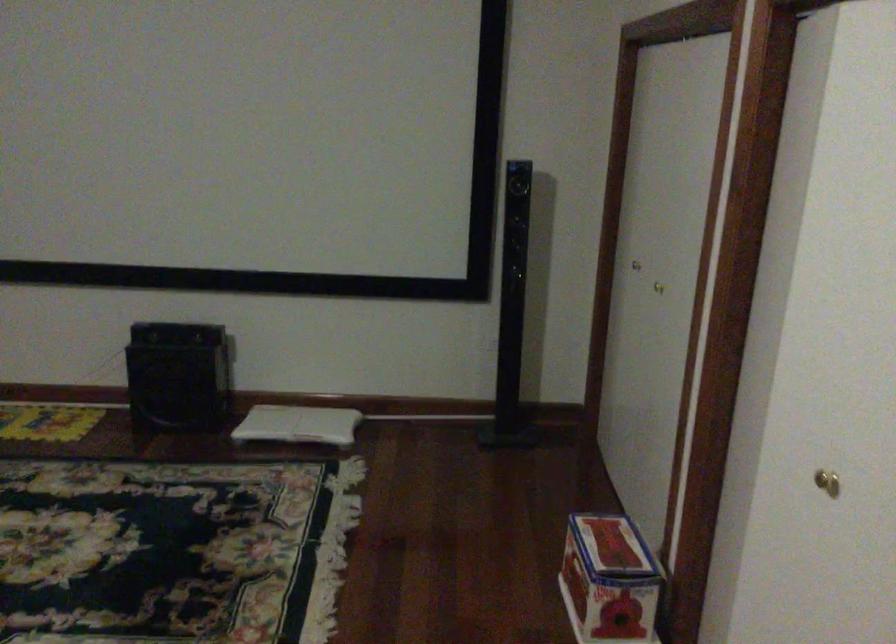
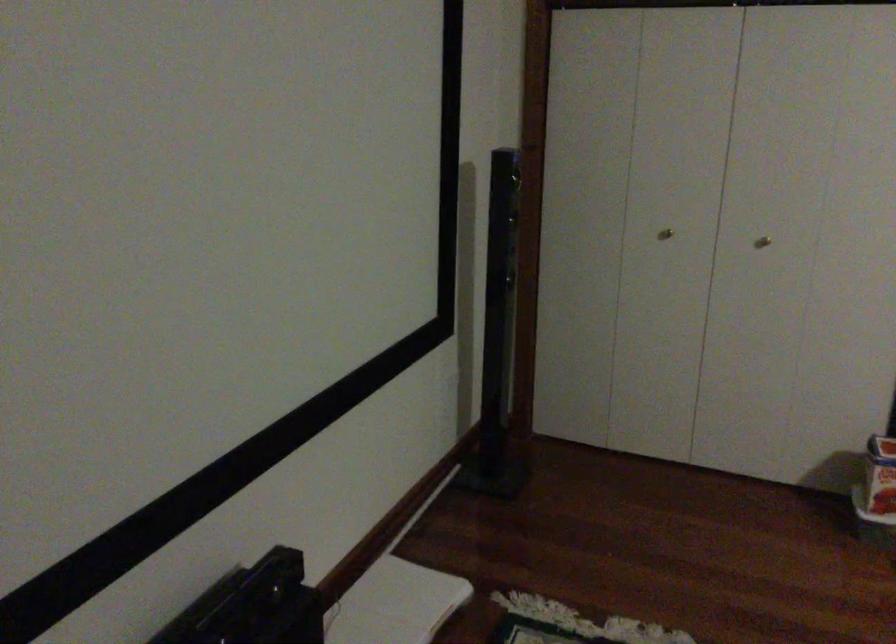
Find the pixel in the second image that matches (625,267) in the first image.

(665, 234)